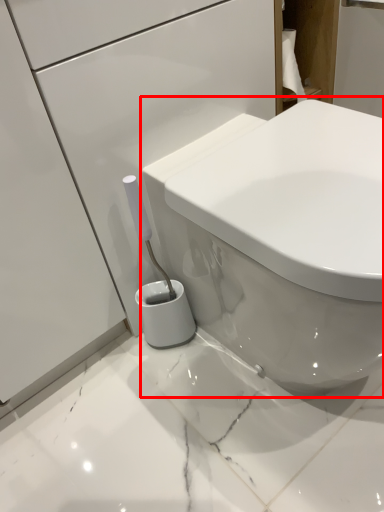
Question: Where is toilet (annotated by the red box) located in relation to cabinetry in the image?

Choices:
 (A) right
 (B) left

Answer: (B)